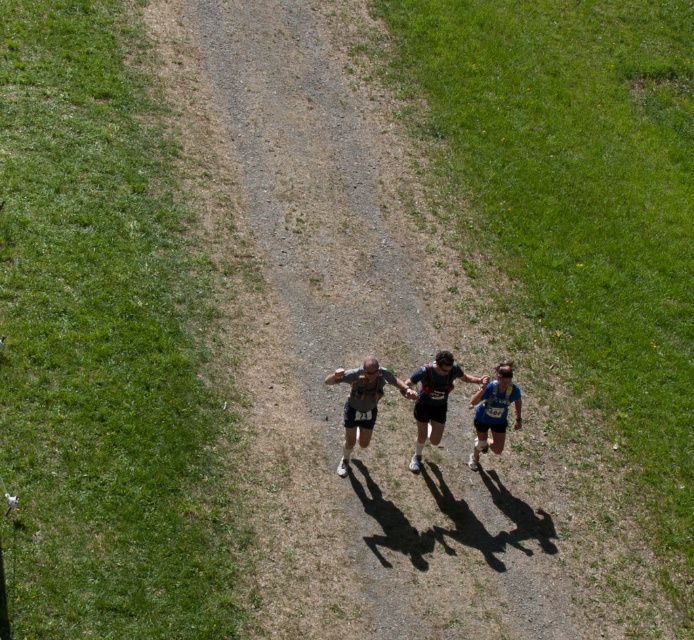
Question: Which point is farther to the camera?

Choices:
 (A) matte gray tank top at center
 (B) blue fabric runner at center
 (C) matte running gear at center

Answer: (B)

Question: Does matte running gear at center lie in front of blue fabric runner at center?

Choices:
 (A) no
 (B) yes

Answer: (B)

Question: Among these objects, which one is nearest to the camera?

Choices:
 (A) matte gray tank top at center
 (B) matte running gear at center
 (C) blue fabric runner at center

Answer: (A)

Question: Does matte running gear at center have a greater width compared to matte gray tank top at center?

Choices:
 (A) yes
 (B) no

Answer: (A)

Question: Which object is farther from the camera taking this photo?

Choices:
 (A) blue fabric runner at center
 (B) black fabric running suit at center

Answer: (A)

Question: Is black fabric running suit at center above blue fabric runner at center?

Choices:
 (A) no
 (B) yes

Answer: (B)